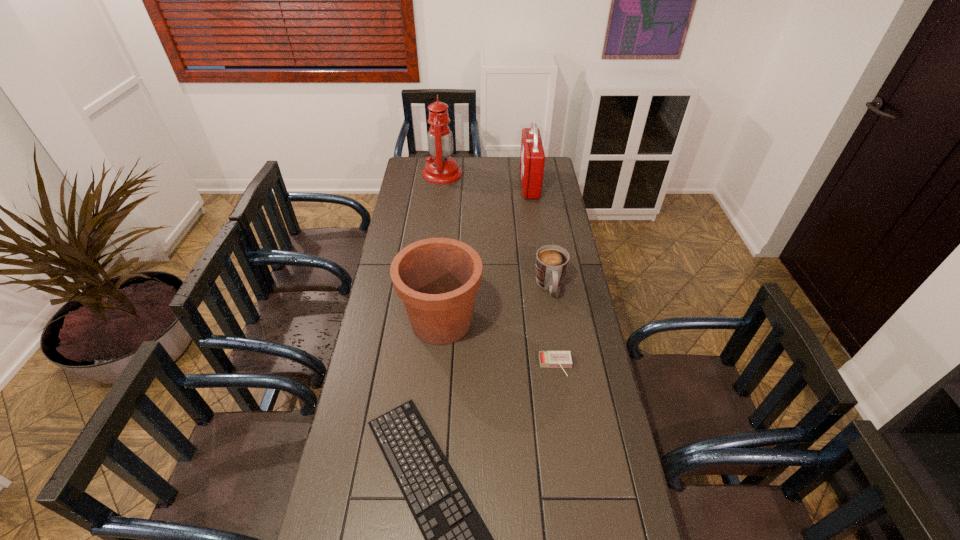
Where is `free point located on the side of the mug with the handle`? The height and width of the screenshot is (540, 960). free point located on the side of the mug with the handle is located at coordinates (555, 319).

Identify the location of free space located 0.370m on the striking surface of the matchbox. This screenshot has width=960, height=540. (575, 498).

This screenshot has width=960, height=540. Identify the location of oil lamp positioned at the far edge. (441, 168).

Find the location of `the first-aid kit at the far edge`. the first-aid kit at the far edge is located at coordinates (532, 158).

In order to click on oil lamp present at the left edge in this screenshot , I will do `click(441, 168)`.

Locate an element on the screen. The image size is (960, 540). flowerpot that is at the left edge is located at coordinates (437, 279).

Where is `the first-aid kit that is at the right edge`? The width and height of the screenshot is (960, 540). the first-aid kit that is at the right edge is located at coordinates (532, 158).

Where is `mug that is at the right edge`? This screenshot has height=540, width=960. mug that is at the right edge is located at coordinates (551, 265).

Where is `matchbox positioned at the right edge`? The height and width of the screenshot is (540, 960). matchbox positioned at the right edge is located at coordinates (552, 359).

Find the location of a particular element. object situated at the far left corner is located at coordinates (441, 168).